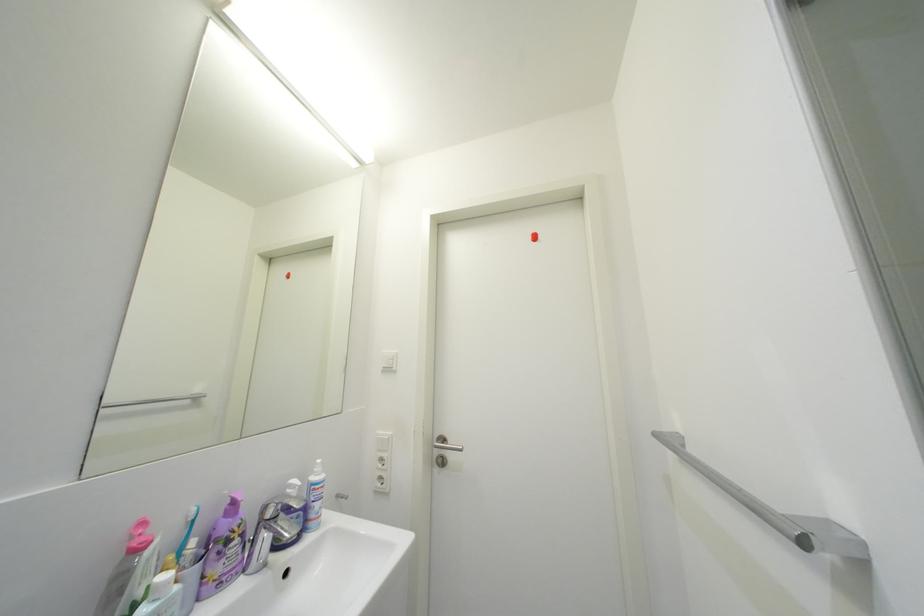
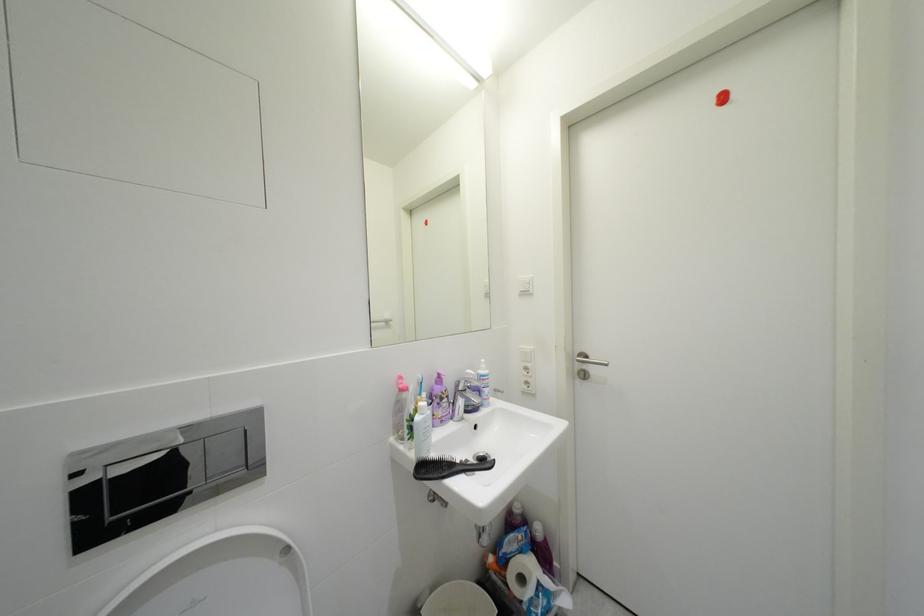
Question: The camera is either moving clockwise (left) or counter-clockwise (right) around the object. The first image is from the beginning of the video and the second image is from the end. Is the camera moving left or right when shooting the video?

Choices:
 (A) Left
 (B) Right

Answer: (B)